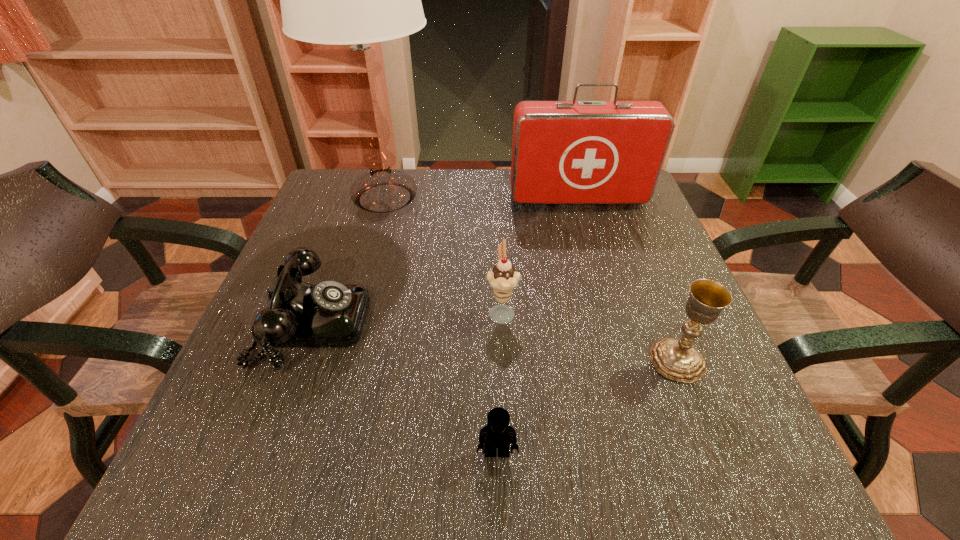
Locate an element on the screen. Image resolution: width=960 pixels, height=540 pixels. free region that satisfies the following two spatial constraints: 1. on the front-facing side of the icecream; 2. on the right side of the tallest object is located at coordinates (352, 311).

Where is `vacant point that satisfies the following two spatial constraints: 1. on the front-facing side of the table lamp; 2. on the back side of the chalice`? The image size is (960, 540). vacant point that satisfies the following two spatial constraints: 1. on the front-facing side of the table lamp; 2. on the back side of the chalice is located at coordinates (339, 360).